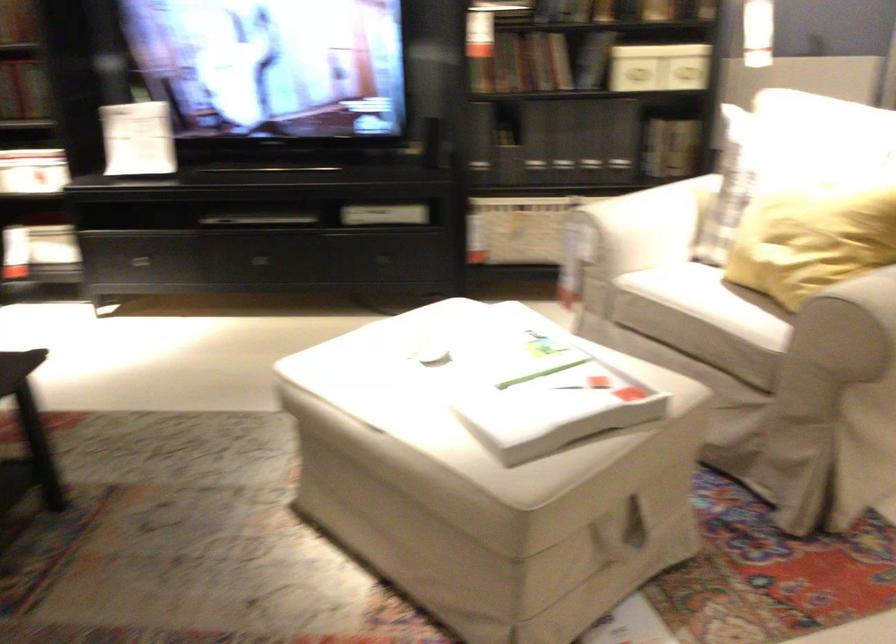
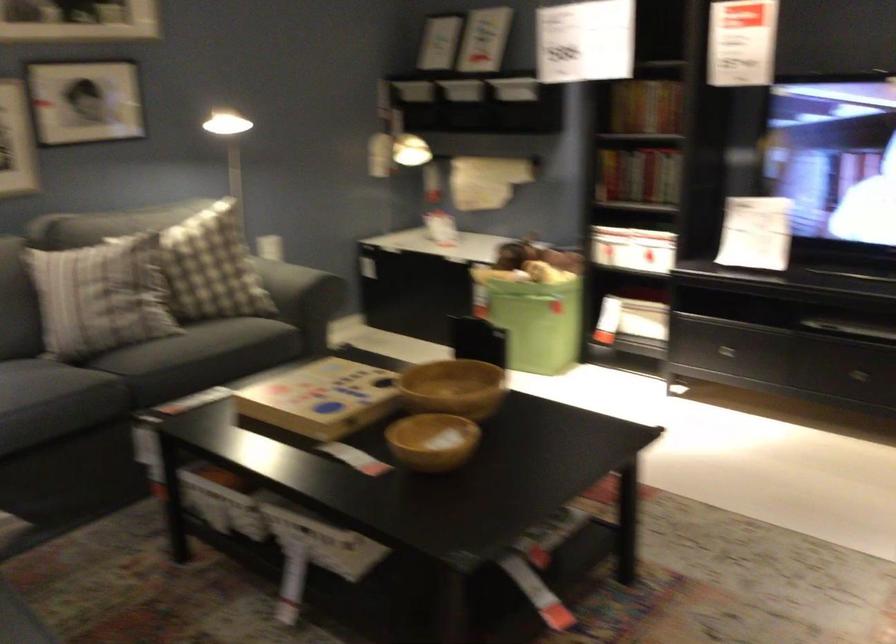
In the second image, find the point that corresponds to (135,152) in the first image.

(755, 232)